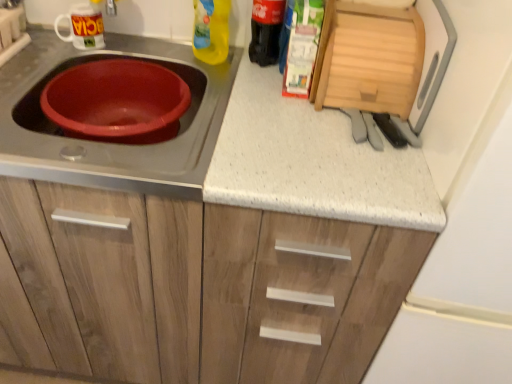
Identify the location of free point in front of yellow plastic bottle at upper center, which is the 2th bottle in right-to-left order. The image size is (512, 384). (206, 79).